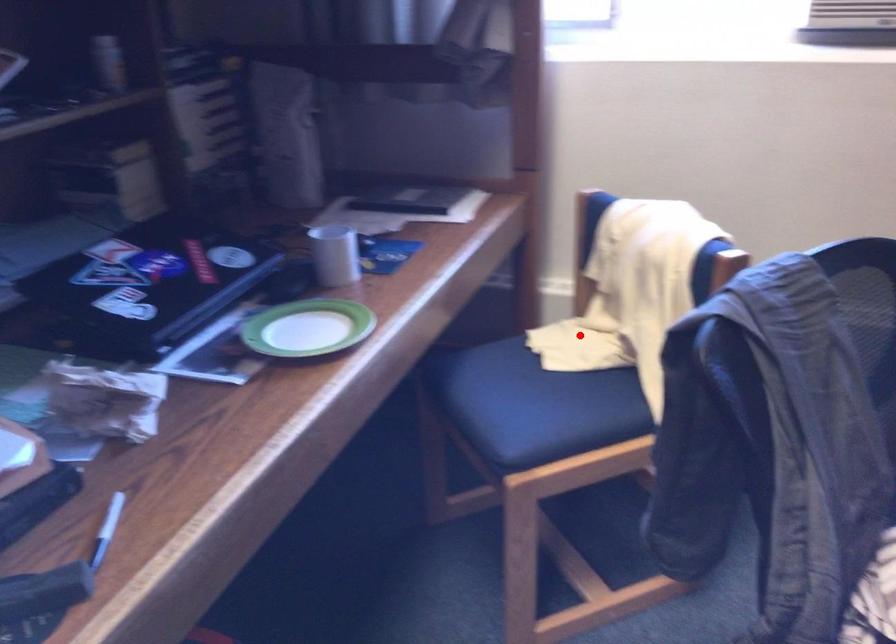
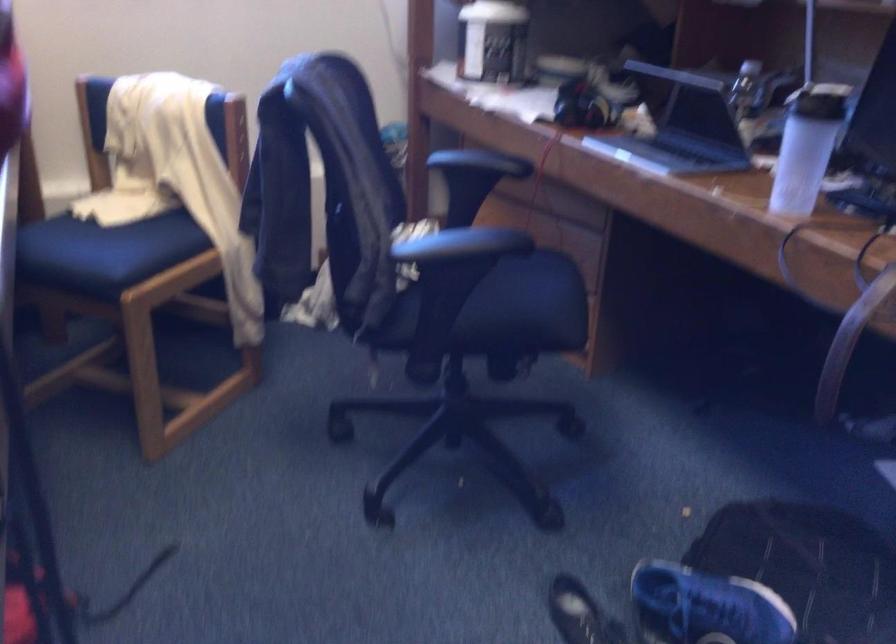
In the second image, find the point that corresponds to the highlighted location in the first image.

(123, 200)